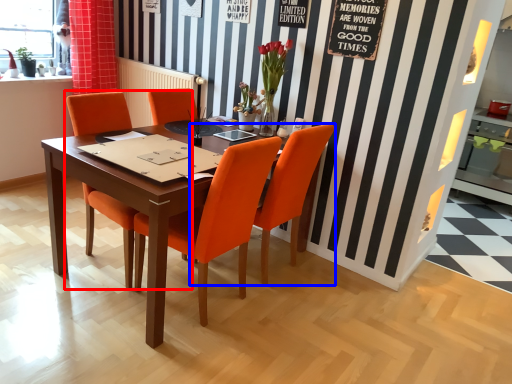
Question: Which point is further to the camera, chair (highlighted by a red box) or chair (highlighted by a blue box)?

Choices:
 (A) chair
 (B) chair

Answer: (B)